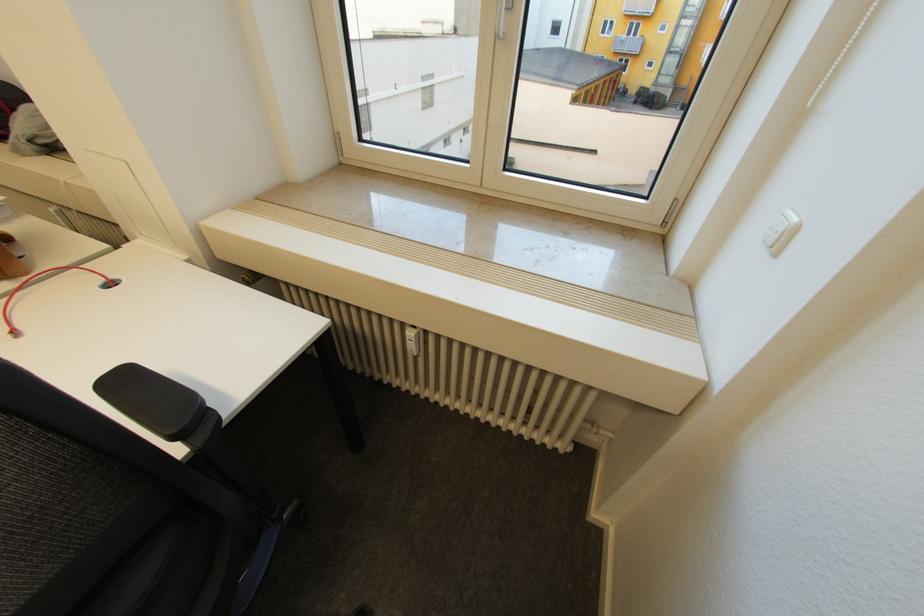
Identify the location of white window handle. (504, 15).